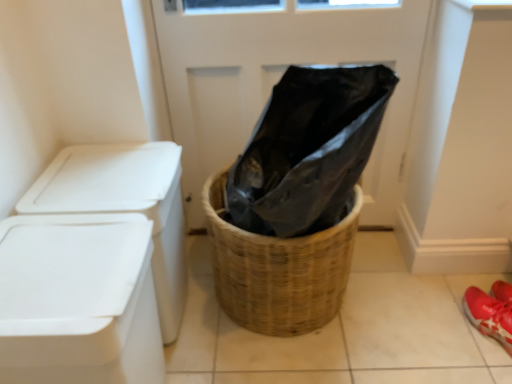
Measure the distance between white plastic container at left and camera.

The depth of white plastic container at left is 28.89 inches.

Locate an element on the screen. This screenshot has width=512, height=384. black plastic bag at center is located at coordinates (280, 77).

In the scene shown: Between black plastic bag at center and white plastic container at left, which one has more height?

black plastic bag at center.

Is black plastic bag at center closer to camera compared to white plastic container at left?

No, the depth of black plastic bag at center is greater than that of white plastic container at left.

Are black plastic bag at center and white plastic container at left far apart?

black plastic bag at center is actually quite close to white plastic container at left.

Is woven brown basket at center facing towards black plastic bag at center?

No, woven brown basket at center is not aimed at black plastic bag at center.

Considering the relative positions of woven brown basket at center and black plastic bag at center in the image provided, is woven brown basket at center in front of black plastic bag at center?

Yes, woven brown basket at center is closer to the camera.

Between woven brown basket at center and black plastic bag at center, which one has more height?

black plastic bag at center.

From a real-world perspective, who is located higher, woven brown basket at center or black plastic bag at center?

In real-world perspective, black plastic bag at center is above.

Looking at this image, between black plastic bag at center and woven brown basket at center, which one appears on the right side from the viewer's perspective?

From the viewer's perspective, black plastic bag at center appears more on the right side.

Is black plastic bag at center oriented towards woven brown basket at center?

Yes.

Is black plastic bag at center inside the boundaries of woven brown basket at center, or outside?

black plastic bag at center is spatially situated outside woven brown basket at center.

Considering the points (178, 257) and (14, 292), which point is in front, point (178, 257) or point (14, 292)?

The point (14, 292) is in front.

How much distance is there between white plastic container at left and white plastic container at left?

A distance of 8.88 inches exists between white plastic container at left and white plastic container at left.

How many degrees apart are the facing directions of white plastic container at left and white plastic container at left?

The facing directions of white plastic container at left and white plastic container at left are 9.32e-05 degrees apart.

Is white plastic container at left taller or shorter than white plastic container at left?

In the image, white plastic container at left appears to be taller than white plastic container at left.

Considering the sizes of objects white plastic container at left and woven brown basket at center in the image provided, who is thinner, white plastic container at left or woven brown basket at center?

white plastic container at left is thinner.

Which object is further away from the camera taking this photo, white plastic container at left or woven brown basket at center?

Positioned behind is woven brown basket at center.

From the picture: Is white plastic container at left aimed at woven brown basket at center?

Yes, white plastic container at left is oriented towards woven brown basket at center.

Where is `screen door behind the white plastic container at left`? screen door behind the white plastic container at left is located at coordinates (280, 77).

Is black plastic bag at center at the back of white plastic container at left?

white plastic container at left does not have its back to black plastic bag at center.

Looking at this image, how much distance is there between white plastic container at left and black plastic bag at center?

31.34 inches.

Is white plastic container at left not near black plastic bag at center?

No, white plastic container at left is not far from black plastic bag at center.

Is woven brown basket at center aimed at white plastic container at left?

No, woven brown basket at center is not oriented towards white plastic container at left.

Considering the relative sizes of woven brown basket at center and white plastic container at left in the image provided, is woven brown basket at center wider than white plastic container at left?

Indeed, woven brown basket at center has a greater width compared to white plastic container at left.

Does woven brown basket at center have a greater height compared to white plastic container at left?

No.

Who is smaller, woven brown basket at center or white plastic container at left?

Smaller between the two is white plastic container at left.

Where is `waste container that appears on the left of black plastic bag at center`? The height and width of the screenshot is (384, 512). waste container that appears on the left of black plastic bag at center is located at coordinates (77, 301).

Where is `basket container that appears below the black plastic bag at center (from the image's perspective)`? This screenshot has height=384, width=512. basket container that appears below the black plastic bag at center (from the image's perspective) is located at coordinates pyautogui.click(x=278, y=269).

Looking at the image, which one is located further to black plastic bag at center, white plastic container at left or woven brown basket at center?

white plastic container at left.

Looking at this image, estimate the real-world distances between objects in this image. Which object is further from white plastic container at left, black plastic bag at center or woven brown basket at center?

black plastic bag at center.

Which object lies further to the anchor point woven brown basket at center, white plastic container at left or black plastic bag at center?

Among the two, black plastic bag at center is located further to woven brown basket at center.

Based on their spatial positions, is white plastic container at left or woven brown basket at center closer to white plastic container at left?

Based on the image, white plastic container at left appears to be nearer to white plastic container at left.

Considering their positions, is white plastic container at left positioned closer to white plastic container at left than black plastic bag at center?

The object closer to white plastic container at left is white plastic container at left.

Looking at the image, which one is located closer to white plastic container at left, woven brown basket at center or black plastic bag at center?

Based on the image, woven brown basket at center appears to be nearer to white plastic container at left.

Based on their spatial positions, is white plastic container at left or white plastic container at left further from woven brown basket at center?

Based on the image, white plastic container at left appears to be further to woven brown basket at center.

Estimate the real-world distances between objects in this image. Which object is closer to black plastic bag at center, white plastic container at left or woven brown basket at center?

woven brown basket at center lies closer to black plastic bag at center than the other object.

Identify the location of washer situated between white plastic container at left and woven brown basket at center from left to right. (125, 205).

Locate an element on the screen. The height and width of the screenshot is (384, 512). basket container located between white plastic container at left and black plastic bag at center in the left-right direction is located at coordinates click(x=278, y=269).

You are a GUI agent. You are given a task and a screenshot of the screen. Output one action in this format:
    pyautogui.click(x=<x>, y=<y>)
    Task: Click on the washer located between white plastic container at left and black plastic bag at center in the left-right direction
    
    Given the screenshot: What is the action you would take?
    pyautogui.click(x=125, y=205)

Find the location of a particular element. basket container between black plastic bag at center and white plastic container at left in the up-down direction is located at coordinates (278, 269).